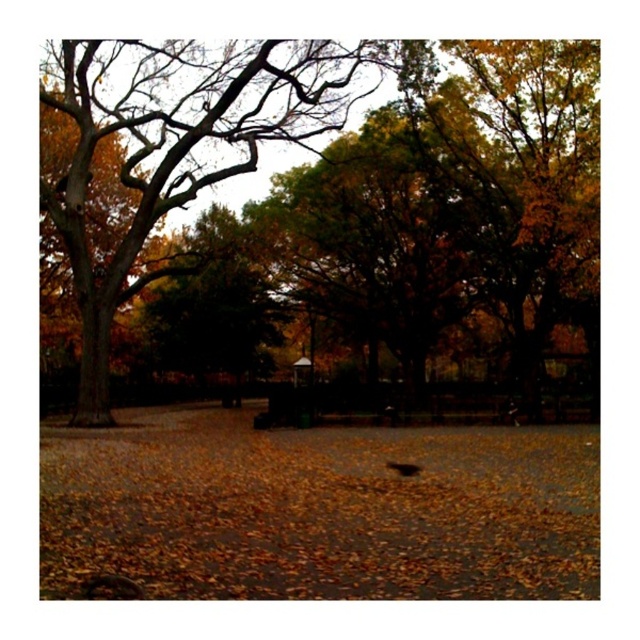
You are a park visitor who wants to take a photo of the golden textured tree at left without any leaves in the foreground. Since you are standing on the paved pathway, can you adjust your angle to avoid capturing the brown leaf litter at center in your shot?

The brown leaf litter at center is positioned under the golden textured tree at left, so if you position yourself on the paved pathway and angle your camera upwards to focus on the tree, you can avoid capturing the leaf litter in the foreground.

You are a park visitor trying to walk along the paved pathway. The brown leaf litter at center is in your way. Can you step around it using the space next to the golden textured tree at left?

The brown leaf litter at center has a lesser width compared to the golden textured tree at left, so yes, you can step around the brown leaf litter at center by moving to the side of the golden textured tree at left since there is more space there.

You are standing at the point marked as point (432, 500) in the park. A squirrel is running towards you from the direction of the paved pathway. If the squirrel can run at a speed of 5 feet per second, how many seconds will it take for the squirrel to reach you?

The distance between point (432, 500) and the viewer is 41.41 feet. Since the squirrel is coming from the direction of the paved pathway, it needs to cover this distance. At 5 feet per second, the time taken would be 41.41 divided by 5, which is approximately 8.28 seconds.